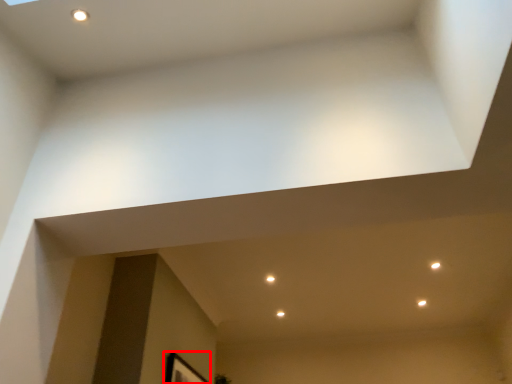
Question: Observing the image, what is the correct spatial positioning of picture frame (annotated by the red box) in reference to light?

Choices:
 (A) right
 (B) left

Answer: (B)